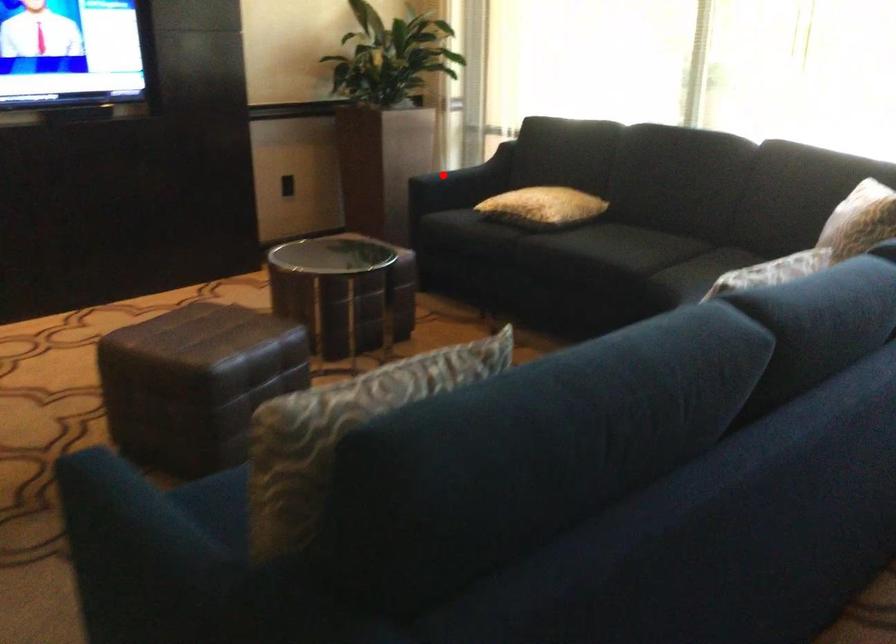
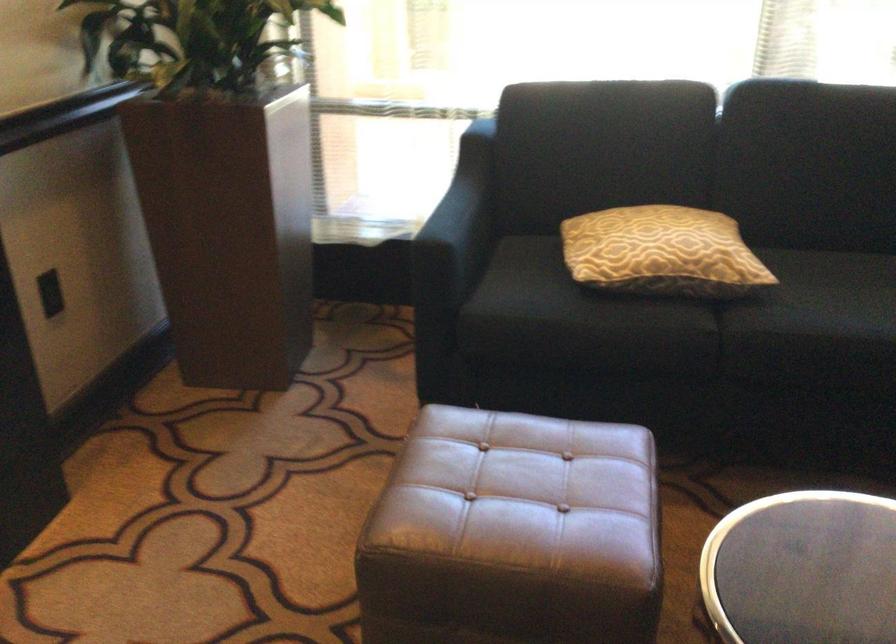
In the second image, find the point that corresponds to the highlighted location in the first image.

(458, 225)